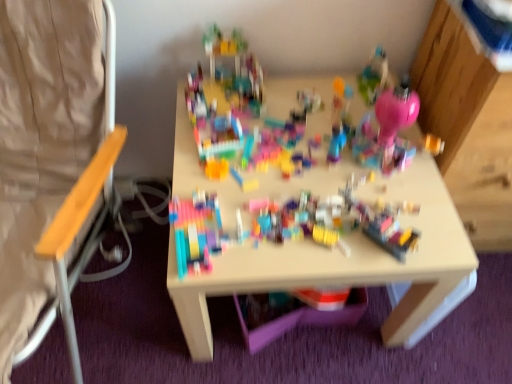
Question: From the image's perspective, is multicolored plastic blocks at center, which is the 2th toy in back-to-front order, located beneath translucent plastic container at center, which appears as the second toy when viewed from the left?

Choices:
 (A) yes
 (B) no

Answer: (B)

Question: Can translucent plastic container at center, which is the 2th toy in top-to-bottom order, be found inside multicolored plastic blocks at center, which is the 2th toy in back-to-front order?

Choices:
 (A) yes
 (B) no

Answer: (B)

Question: Does multicolored plastic blocks at center, the 2th toy positioned from the right, lie in front of translucent plastic container at center, the 2th toy in the front-to-back sequence?

Choices:
 (A) no
 (B) yes

Answer: (B)

Question: Does multicolored plastic blocks at center, which is the 2th toy in back-to-front order, touch translucent plastic container at center, which is the 2th toy in top-to-bottom order?

Choices:
 (A) yes
 (B) no

Answer: (B)

Question: Considering the relative sizes of multicolored plastic blocks at center, the 1th toy positioned from the top, and translucent plastic container at center, which is counted as the 1th toy, starting from the back, in the image provided, is multicolored plastic blocks at center, the 1th toy positioned from the top, shorter than translucent plastic container at center, which is counted as the 1th toy, starting from the back,?

Choices:
 (A) no
 (B) yes

Answer: (A)

Question: Would you consider multicolored plastic blocks at center, which is counted as the 1th toy, starting from the front, to be distant from translucent plastic container at center, the first toy when ordered from bottom to top?

Choices:
 (A) no
 (B) yes

Answer: (A)

Question: From a real-world perspective, is multicolored plastic blocks at center, which is counted as the 1th toy, starting from the front, over wooden seat at left?

Choices:
 (A) yes
 (B) no

Answer: (B)

Question: Is multicolored plastic blocks at center, the 2th toy positioned from the right, behind wooden seat at left?

Choices:
 (A) yes
 (B) no

Answer: (A)

Question: From a real-world perspective, does multicolored plastic blocks at center, positioned as the first toy in left-to-right order, sit lower than wooden seat at left?

Choices:
 (A) no
 (B) yes

Answer: (B)

Question: From the image's perspective, does multicolored plastic blocks at center, which is the 2th toy in back-to-front order, appear lower than wooden seat at left?

Choices:
 (A) yes
 (B) no

Answer: (A)

Question: Is multicolored plastic blocks at center, which is the 2th toy in back-to-front order, next to wooden seat at left?

Choices:
 (A) no
 (B) yes

Answer: (A)

Question: Is multicolored plastic blocks at center, the 2th toy positioned from the right, at the left side of wooden seat at left?

Choices:
 (A) yes
 (B) no

Answer: (B)

Question: Could you tell me if wooden seat at left is facing multicolored plastic blocks at center, the 2th toy positioned from the right?

Choices:
 (A) no
 (B) yes

Answer: (A)